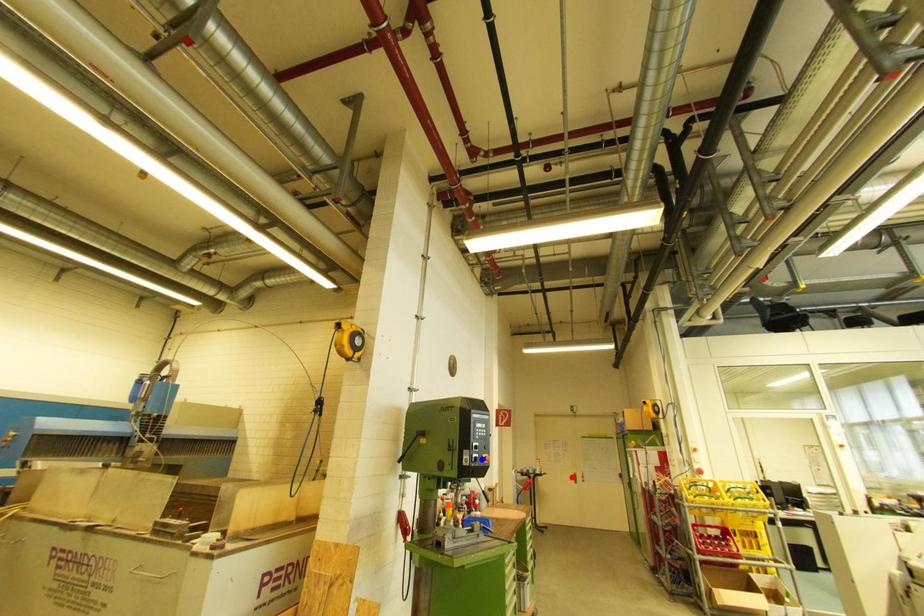
Question: Which of the two points in the image is closer to the camera?

Choices:
 (A) Blue point is closer.
 (B) Red point is closer.

Answer: (A)